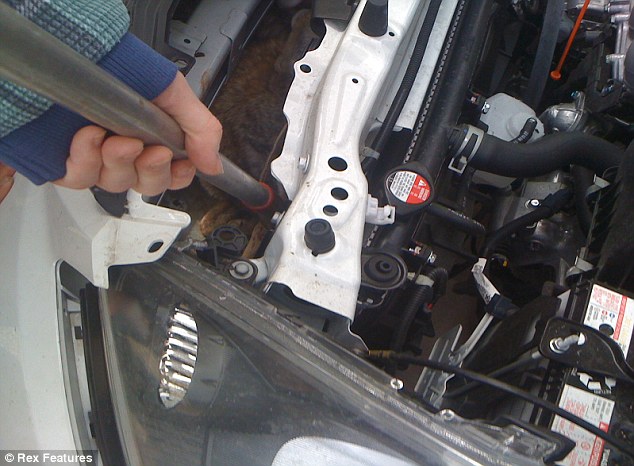
You are a GUI agent. You are given a task and a screenshot of the screen. Output one action in this format:
    pyautogui.click(x=<x>, y=<y>)
    Task: Click on the silver screw
    This screenshot has height=466, width=634.
    Given the screenshot: What is the action you would take?
    pyautogui.click(x=571, y=339)